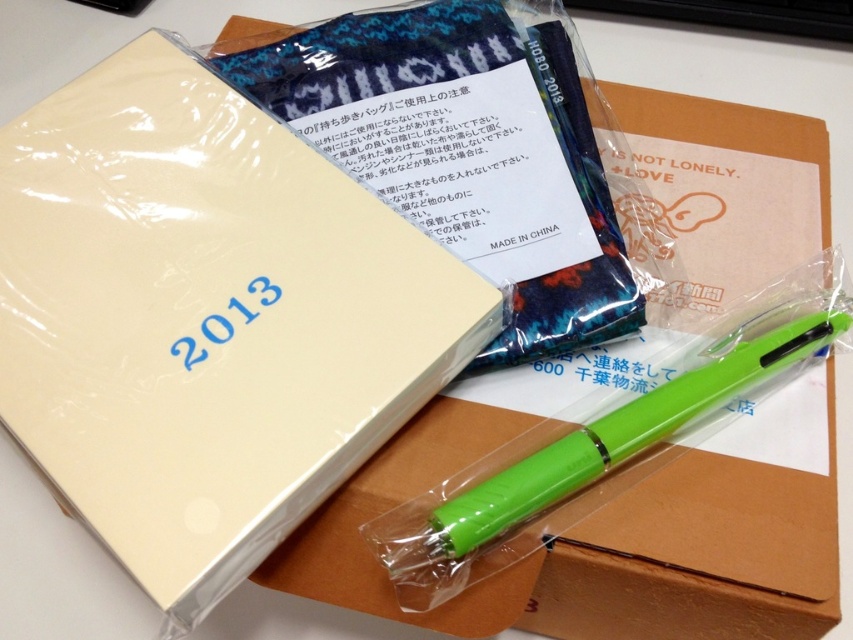
You are organizing items on a desk and need to stack the matte brown cardboard box at center and the green plastic pen at lower right. Can you place the taller item on top of the shorter one without it falling over?

The matte brown cardboard box at center is taller than the green plastic pen at lower right. Since the box is taller, placing it on top of the pen would likely cause it to fall over due to instability. It is better to place the shorter pen on top of the taller box for stability.

Where is the matte cream notepad at upper left located in the image?

The matte cream notepad at upper left is located at point (206, 320) in the image.